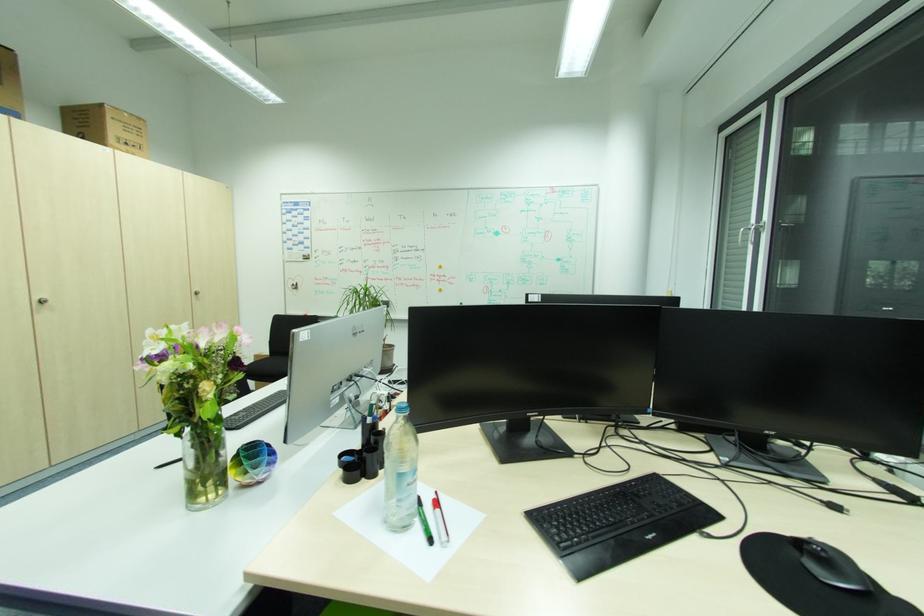
Where is `silver cabinet handle`? silver cabinet handle is located at coordinates (42, 301).